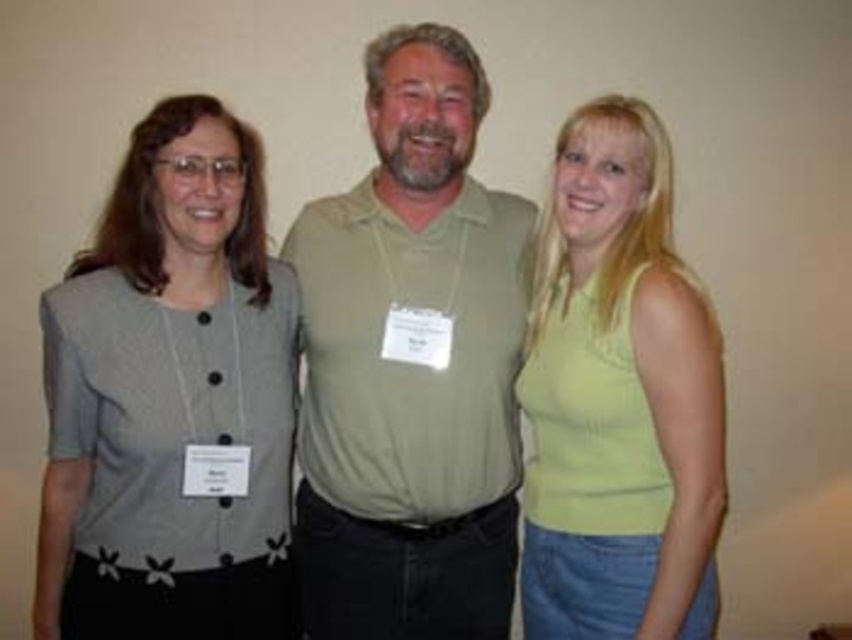
Is green cotton polo shirt at center wider than lime green sleeveless top at right?

Indeed, green cotton polo shirt at center has a greater width compared to lime green sleeveless top at right.

Does green cotton polo shirt at center appear under lime green sleeveless top at right?

Actually, green cotton polo shirt at center is above lime green sleeveless top at right.

This screenshot has height=640, width=852. Describe the element at coordinates (412, 365) in the screenshot. I see `green cotton polo shirt at center` at that location.

Find the location of a particular element. Image resolution: width=852 pixels, height=640 pixels. green cotton polo shirt at center is located at coordinates (412, 365).

This screenshot has height=640, width=852. In order to click on green cotton polo shirt at center in this screenshot , I will do `click(412, 365)`.

Is point (344, 205) closer to viewer compared to point (124, 604)?

No, it is not.

Is point (479, 268) closer to camera compared to point (256, 273)?

No.

The height and width of the screenshot is (640, 852). In order to click on green cotton polo shirt at center in this screenshot , I will do `click(412, 365)`.

Between gray fabric blouse at left and lime green sleeveless top at right, which one has less height?

gray fabric blouse at left is shorter.

Is gray fabric blouse at left above lime green sleeveless top at right?

Yes, gray fabric blouse at left is above lime green sleeveless top at right.

Locate an element on the screen. This screenshot has width=852, height=640. gray fabric blouse at left is located at coordinates (168, 397).